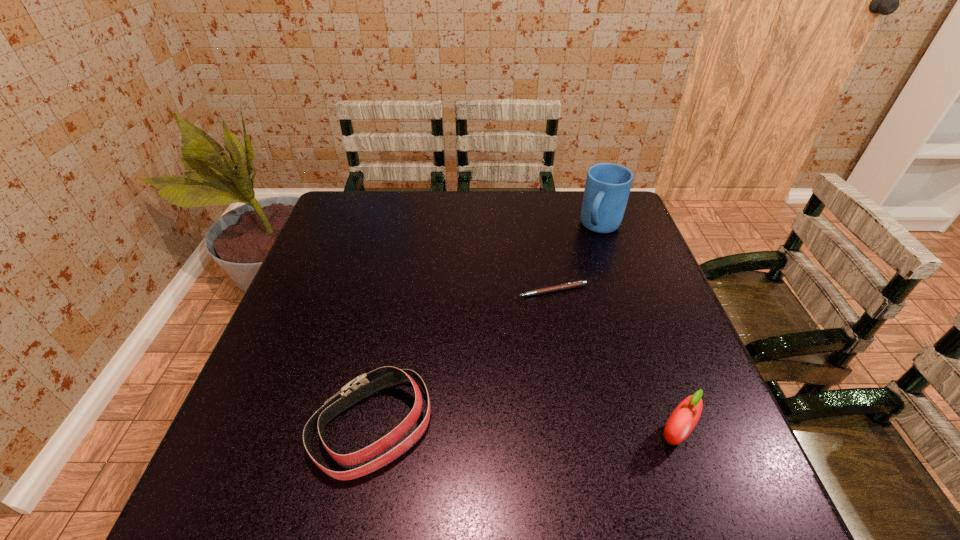
The height and width of the screenshot is (540, 960). What are the coordinates of `free space at the far right corner` in the screenshot? It's located at (623, 227).

You are a GUI agent. You are given a task and a screenshot of the screen. Output one action in this format:
    pyautogui.click(x=<x>, y=<y>)
    Task: Click on the free region at the near right corner of the desktop
    This screenshot has height=540, width=960.
    Given the screenshot: What is the action you would take?
    pyautogui.click(x=698, y=429)

You are a GUI agent. You are given a task and a screenshot of the screen. Output one action in this format:
    pyautogui.click(x=<x>, y=<y>)
    Task: Click on the vacant area that lies between the apple and the farthest object
    Image resolution: width=960 pixels, height=540 pixels.
    Given the screenshot: What is the action you would take?
    pyautogui.click(x=638, y=331)

You are a GUI agent. You are given a task and a screenshot of the screen. Output one action in this format:
    pyautogui.click(x=<x>, y=<y>)
    Task: Click on the vacant point located between the third tallest object and the third nearest object
    The height and width of the screenshot is (540, 960).
    Given the screenshot: What is the action you would take?
    pyautogui.click(x=463, y=359)

I want to click on empty space that is in between the shortest object and the tallest object, so click(x=577, y=259).

Identify the location of empty space between the apple and the dog collar. Image resolution: width=960 pixels, height=540 pixels. (523, 431).

Image resolution: width=960 pixels, height=540 pixels. In order to click on empty space that is in between the third shortest object and the third object from right to left in this screenshot , I will do `click(614, 363)`.

I want to click on vacant region between the third nearest object and the farthest object, so click(x=577, y=259).

Find the location of `vacant region between the leftmost object and the second tallest object`. vacant region between the leftmost object and the second tallest object is located at coordinates (523, 431).

I want to click on free spot between the pen and the second tallest object, so click(614, 363).